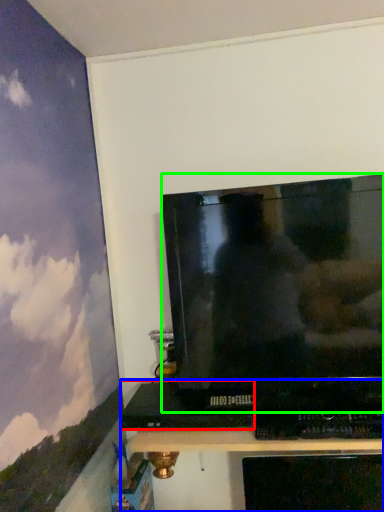
Question: Considering the real-world distances, which object is closest to computer (highlighted by a red box)? furniture (highlighted by a blue box) or television (highlighted by a green box).

Choices:
 (A) furniture
 (B) television

Answer: (B)